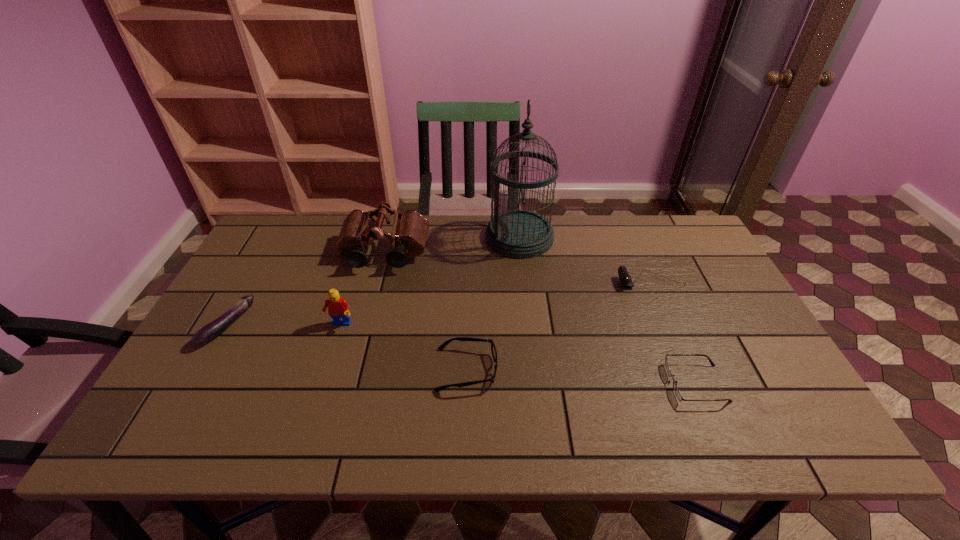
The height and width of the screenshot is (540, 960). What are the coordinates of `free spot between the webcam and the taller spectacles` in the screenshot? It's located at (559, 325).

This screenshot has height=540, width=960. What are the coordinates of `free space between the taller spectacles and the Lego` in the screenshot? It's located at (403, 347).

Locate an element on the screen. free space between the tallest object and the Lego is located at coordinates (429, 281).

Locate which object ranks in proximity to the Lego. Please provide its 2D coordinates. Your answer should be formatted as a tuple, i.e. [(x, y)], where the tuple contains the x and y coordinates of a point satisfying the conditions above.

[(409, 233)]

The width and height of the screenshot is (960, 540). I want to click on object that is the fourth nearest to the taller spectacles, so click(676, 390).

Where is `vacant space that satisfies the following two spatial constraints: 1. on the front-facing side of the birdcage; 2. through the eyepieces of the binoculars`? This screenshot has height=540, width=960. vacant space that satisfies the following two spatial constraints: 1. on the front-facing side of the birdcage; 2. through the eyepieces of the binoculars is located at coordinates (521, 253).

Find the location of a particular element. The height and width of the screenshot is (540, 960). free region that satisfies the following two spatial constraints: 1. on the front-facing side of the birdcage; 2. on the front-facing side of the Lego is located at coordinates (529, 325).

You are a GUI agent. You are given a task and a screenshot of the screen. Output one action in this format:
    pyautogui.click(x=<x>, y=<y>)
    Task: Click on the free space that satisfies the following two spatial constraints: 1. on the front-facing side of the tallest object; 2. on the front side of the leftmost object
    
    Given the screenshot: What is the action you would take?
    pyautogui.click(x=529, y=326)